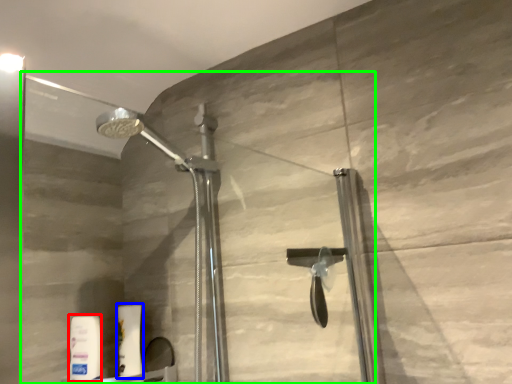
Question: Which is farther away from toiletry (highlighted by a red box)? toiletry (highlighted by a blue box) or glass door (highlighted by a green box)?

Choices:
 (A) toiletry
 (B) glass door

Answer: (B)